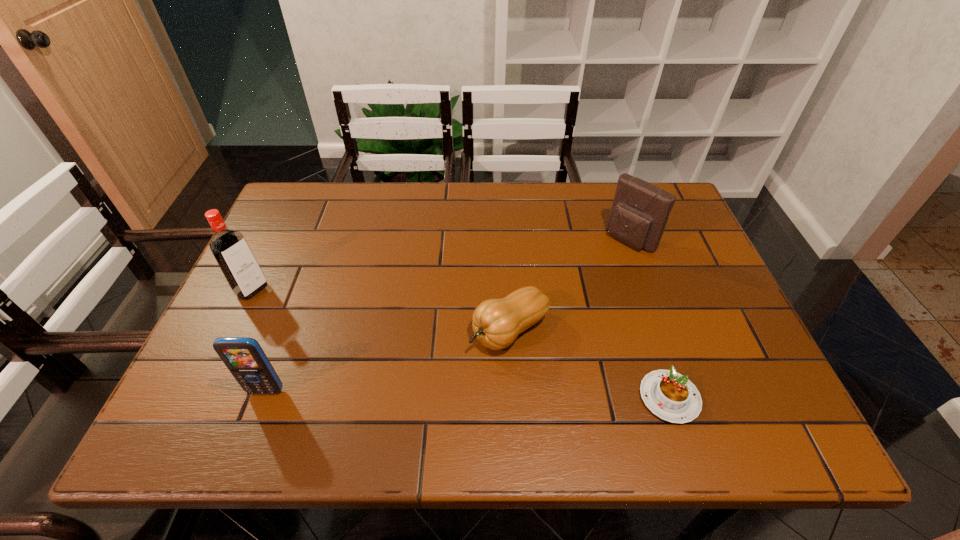
Where is `cellular telephone that is at the left edge`? The height and width of the screenshot is (540, 960). cellular telephone that is at the left edge is located at coordinates (245, 359).

Where is `vodka situated at the left edge`? Image resolution: width=960 pixels, height=540 pixels. vodka situated at the left edge is located at coordinates (230, 249).

The height and width of the screenshot is (540, 960). Find the location of `pudding present at the right edge`. pudding present at the right edge is located at coordinates (669, 395).

At what (x,y) coordinates should I click in order to perform the action: click on pouch that is positioned at the right edge. Please return your answer as a coordinate pair (x, y). Looking at the image, I should click on (640, 210).

I want to click on object that is at the near left corner, so click(245, 359).

The image size is (960, 540). I want to click on object that is at the far right corner, so click(640, 210).

Find the location of a particular element. This screenshot has height=540, width=960. object present at the near right corner is located at coordinates (669, 395).

In the image, there is a desktop. In order to click on blank space at the far edge in this screenshot , I will do `click(576, 204)`.

The width and height of the screenshot is (960, 540). Find the location of `vacant position at the near edge of the desktop`. vacant position at the near edge of the desktop is located at coordinates (580, 381).

Find the location of a particular element. This screenshot has width=960, height=540. vacant area at the right edge is located at coordinates (689, 234).